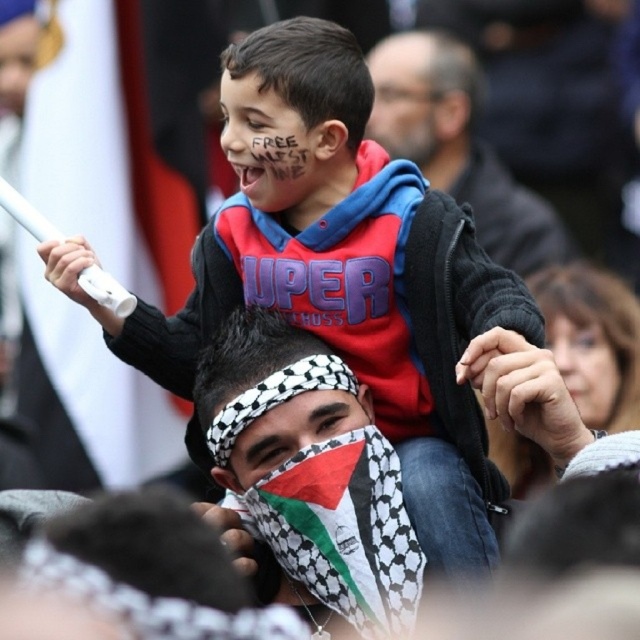
Question: Among these points, which one is nearest to the camera?

Choices:
 (A) (292, 145)
 (B) (316, 396)
 (C) (596, 365)
 (D) (433, 140)

Answer: (A)

Question: Can you confirm if matte black jacket at upper center is thinner than palestinian flag at center?

Choices:
 (A) yes
 (B) no

Answer: (B)

Question: Which point is farther to the camera?

Choices:
 (A) click(397, 49)
 (B) click(604, 358)
 (C) click(237, 465)
 (D) click(486, 540)

Answer: (A)

Question: Which point is closer to the camera?

Choices:
 (A) checkered fabric headscarf at center
 (B) palestinian flag at center

Answer: (A)

Question: Does matte black jacket at upper center appear under smooth skin face at upper right?

Choices:
 (A) yes
 (B) no

Answer: (B)

Question: Does matte red hoodie at upper center have a smaller size compared to smooth skin face at upper right?

Choices:
 (A) no
 (B) yes

Answer: (A)